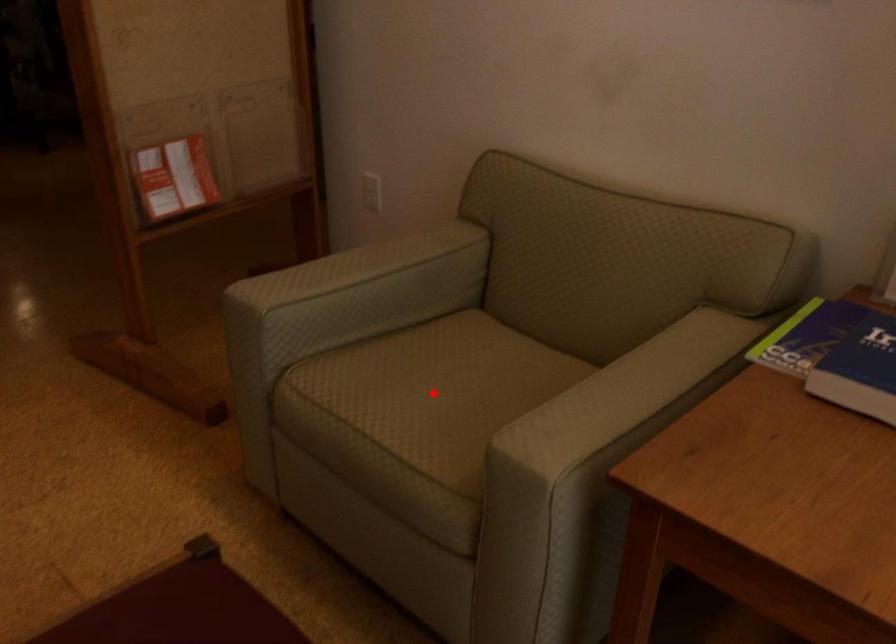
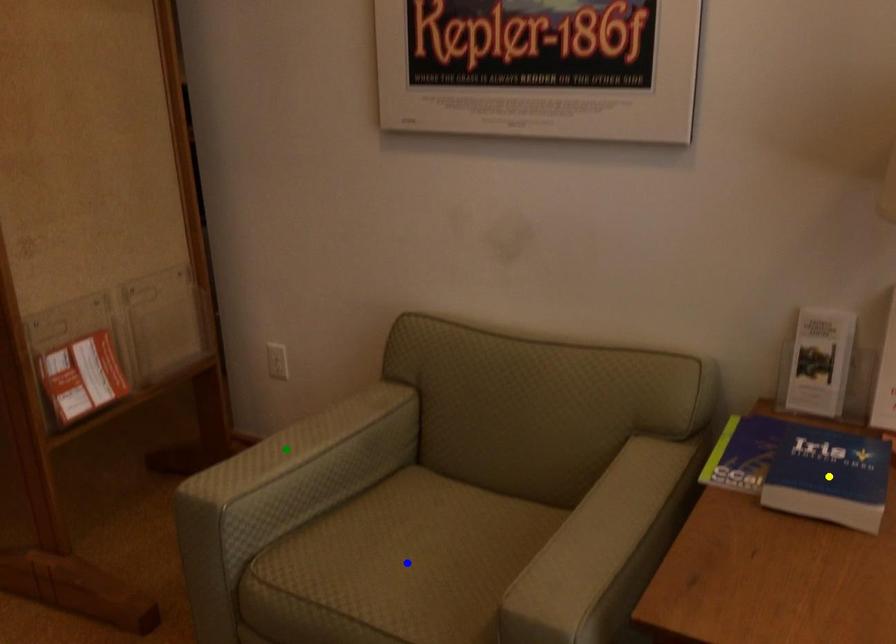
Question: I am providing you with two images of the same scene from different viewpoints. A red point is marked on the first image. You are given multiple points on the second image. Which spot in image 2 lines up with the point in image 1?

Choices:
 (A) green point
 (B) yellow point
 (C) blue point

Answer: (C)